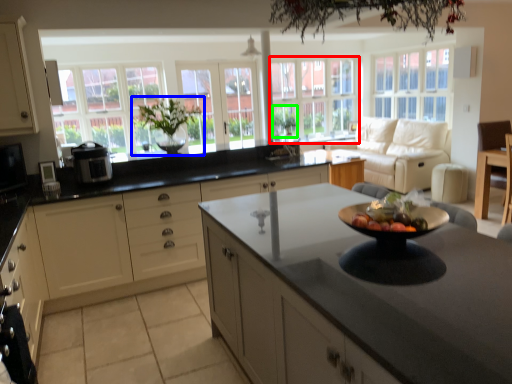
Question: Based on their relative distances, which object is farther from window (highlighted by a red box)? Choose from houseplant (highlighted by a blue box) and plant (highlighted by a green box).

Choices:
 (A) houseplant
 (B) plant

Answer: (A)